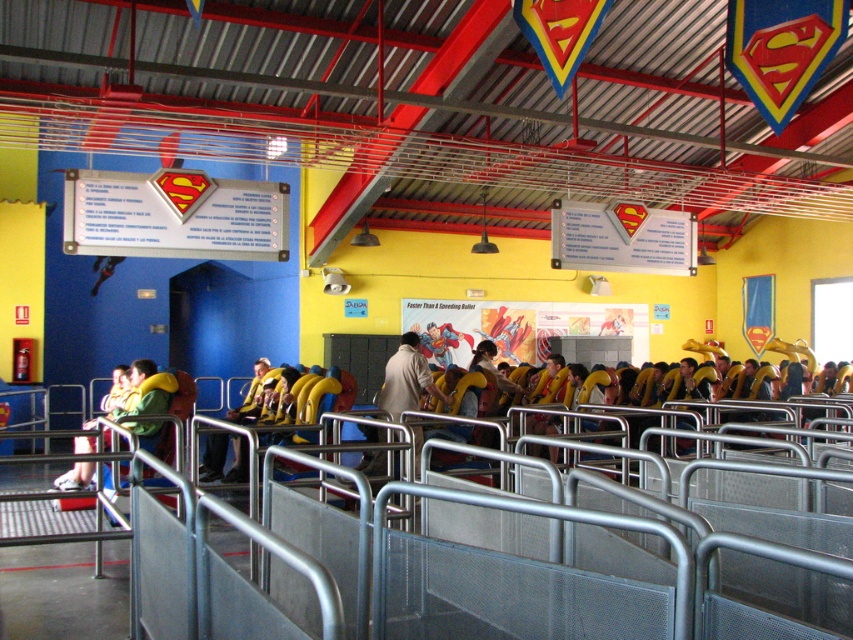
Between metallic silver rail at center and green fabric jacket at center, which one appears on the left side from the viewer's perspective?

green fabric jacket at center is more to the left.

Can you confirm if metallic silver rail at center is bigger than green fabric jacket at center?

No.

At what (x,y) coordinates should I click in order to perform the action: click on metallic silver rail at center. Please return your answer as a coordinate pair (x, y). Image resolution: width=853 pixels, height=640 pixels. Looking at the image, I should click on (521, 579).

Is green fabric jacket at center to the right of light brown leather jacket at center from the viewer's perspective?

Incorrect, green fabric jacket at center is not on the right side of light brown leather jacket at center.

Consider the image. Is green fabric jacket at center above light brown leather jacket at center?

Yes.

What do you see at coordinates (146, 390) in the screenshot? The image size is (853, 640). I see `green fabric jacket at center` at bounding box center [146, 390].

I want to click on green fabric jacket at center, so click(x=146, y=390).

Describe the element at coordinates (521, 579) in the screenshot. The image size is (853, 640). I see `metallic silver rail at center` at that location.

Image resolution: width=853 pixels, height=640 pixels. What do you see at coordinates (521, 579) in the screenshot? I see `metallic silver rail at center` at bounding box center [521, 579].

I want to click on metallic silver rail at center, so click(521, 579).